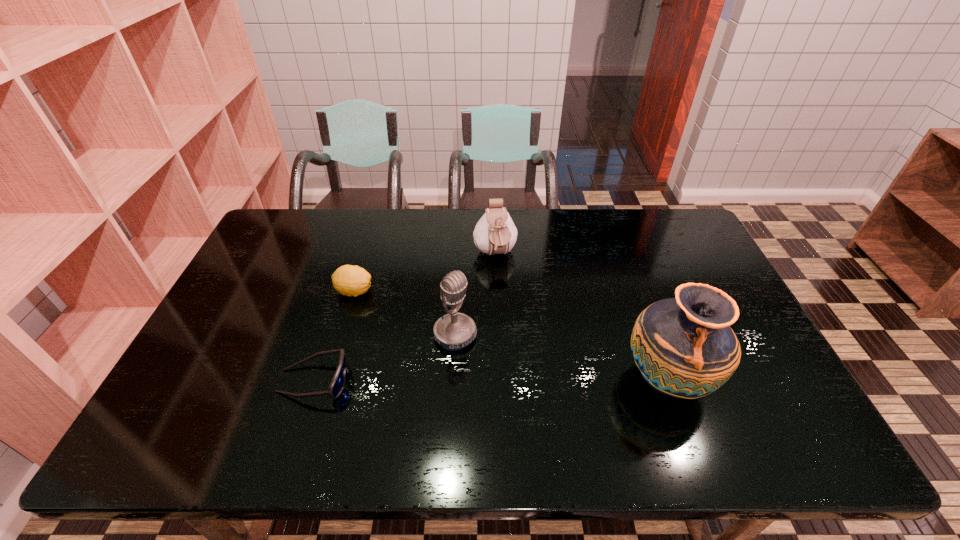
You are a GUI agent. You are given a task and a screenshot of the screen. Output one action in this format:
    pyautogui.click(x=<x>, y=<y>)
    Task: Click on the free area in between the fourth nearest object and the pouch
    This screenshot has height=540, width=960.
    Given the screenshot: What is the action you would take?
    pyautogui.click(x=424, y=273)

This screenshot has width=960, height=540. I want to click on free point between the microphone and the rightmost object, so click(562, 357).

Locate an element on the screen. Image resolution: width=960 pixels, height=540 pixels. vacant space in between the second tallest object and the tallest object is located at coordinates (562, 357).

Where is `vacant space that is in between the second shortest object and the pouch`? This screenshot has height=540, width=960. vacant space that is in between the second shortest object and the pouch is located at coordinates (424, 273).

This screenshot has height=540, width=960. Identify the location of unoccupied area between the sunglasses and the fourth shortest object. (385, 358).

Image resolution: width=960 pixels, height=540 pixels. What are the coordinates of `vacant space in between the second tallest object and the lemon` in the screenshot? It's located at (404, 313).

Identify the location of empty space between the fourth shortest object and the sunglasses. (385, 358).

Choose which object is the third nearest neighbor to the shortest object. Please provide its 2D coordinates. Your answer should be formatted as a tuple, i.e. [(x, y)], where the tuple contains the x and y coordinates of a point satisfying the conditions above.

[(495, 233)]

Select which object appears as the fourth closest to the shortest object. Please provide its 2D coordinates. Your answer should be formatted as a tuple, i.e. [(x, y)], where the tuple contains the x and y coordinates of a point satisfying the conditions above.

[(684, 347)]

Where is `vacant space that satisfies the following two spatial constraints: 1. on the front side of the tallest object; 2. on the right side of the pouch`? vacant space that satisfies the following two spatial constraints: 1. on the front side of the tallest object; 2. on the right side of the pouch is located at coordinates coord(499,379).